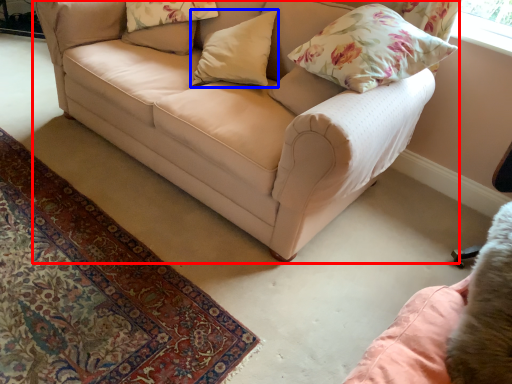
Question: Which object is further to the camera taking this photo, studio couch (highlighted by a red box) or pillow (highlighted by a blue box)?

Choices:
 (A) studio couch
 (B) pillow

Answer: (B)